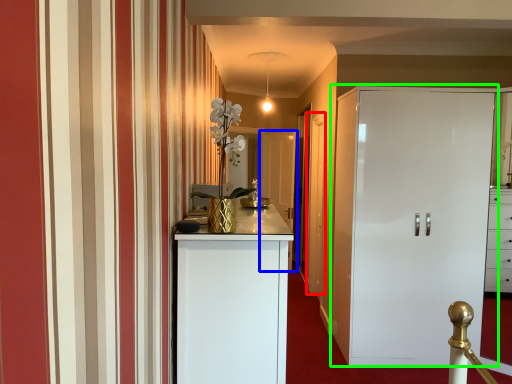
Question: Estimate the real-world distances between objects in this image. Which object is closer to door (highlighted by a red box), door (highlighted by a blue box) or cupboard (highlighted by a green box)?

Choices:
 (A) door
 (B) cupboard

Answer: (B)